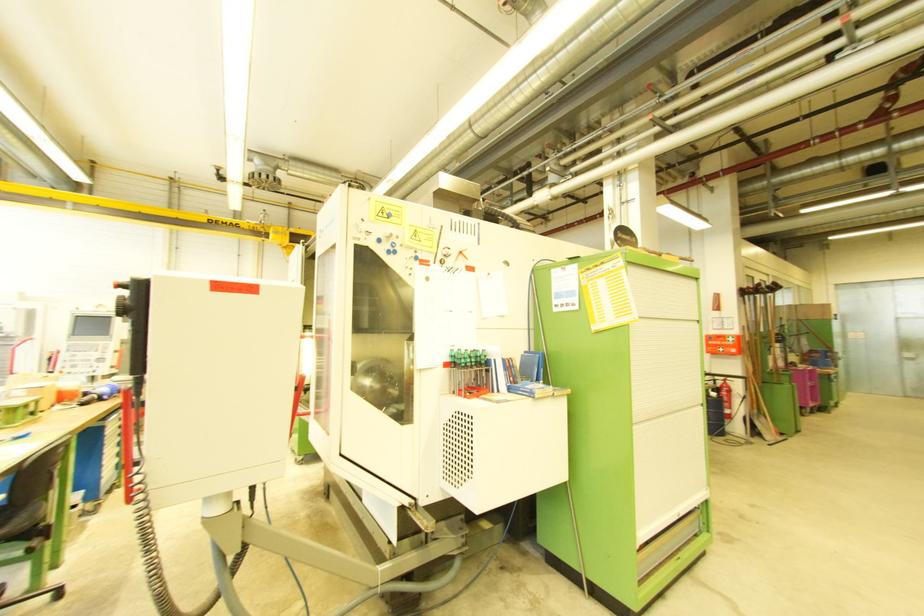
Find where to push the cabinet door handle. Please return your answer as a coordinate pair (x, y).

(666, 517)